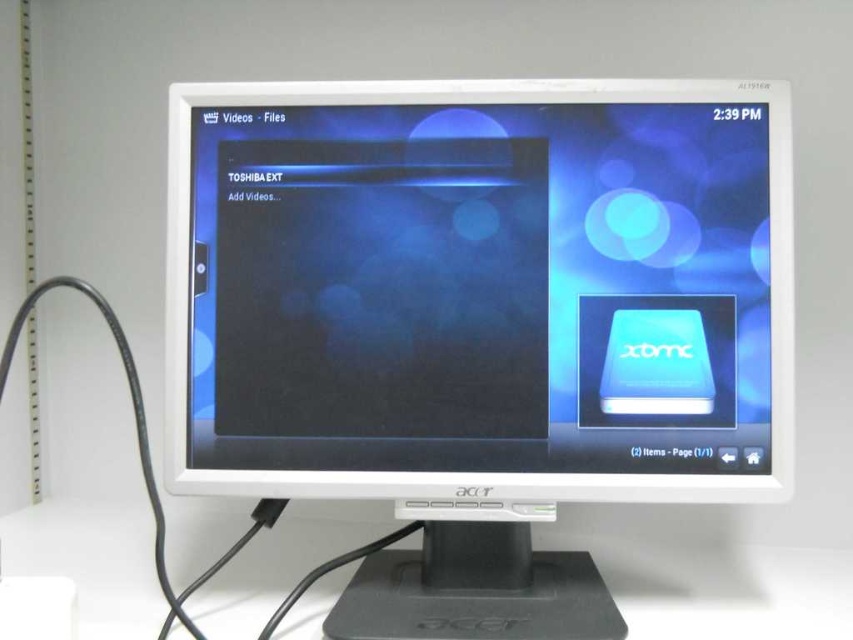
Based on the photo, does white plastic monitor at center have a greater height compared to white plastic computer desk at center?

Correct, white plastic monitor at center is much taller as white plastic computer desk at center.

Measure the distance between point (665,141) and camera.

33.48 inches

Where is `white plastic monitor at center`? Image resolution: width=853 pixels, height=640 pixels. white plastic monitor at center is located at coordinates (480, 321).